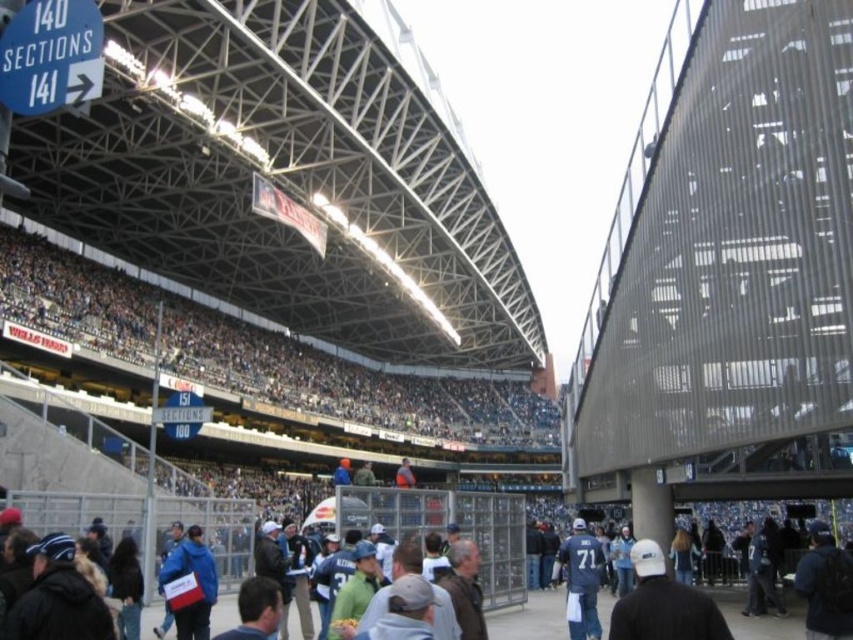
Question: Which object appears closest to the camera in this image?

Choices:
 (A) white cap at center
 (B) blue fabric jacket at lower left

Answer: (A)

Question: Considering the real-world distances, which object is closest to the blue jersey at center?

Choices:
 (A) dark gray concrete crowd at center
 (B) white cap at center
 (C) blue fabric jacket at lower left

Answer: (B)

Question: Can you confirm if dark gray concrete crowd at center is positioned below blue jersey at center?

Choices:
 (A) yes
 (B) no

Answer: (B)

Question: Is dark gray concrete crowd at center smaller than blue fabric jacket at lower left?

Choices:
 (A) yes
 (B) no

Answer: (B)

Question: Among these objects, which one is farthest from the camera?

Choices:
 (A) dark gray concrete crowd at center
 (B) blue fabric jacket at lower left

Answer: (A)

Question: Is the position of dark gray concrete crowd at center less distant than that of white cap at center?

Choices:
 (A) no
 (B) yes

Answer: (A)